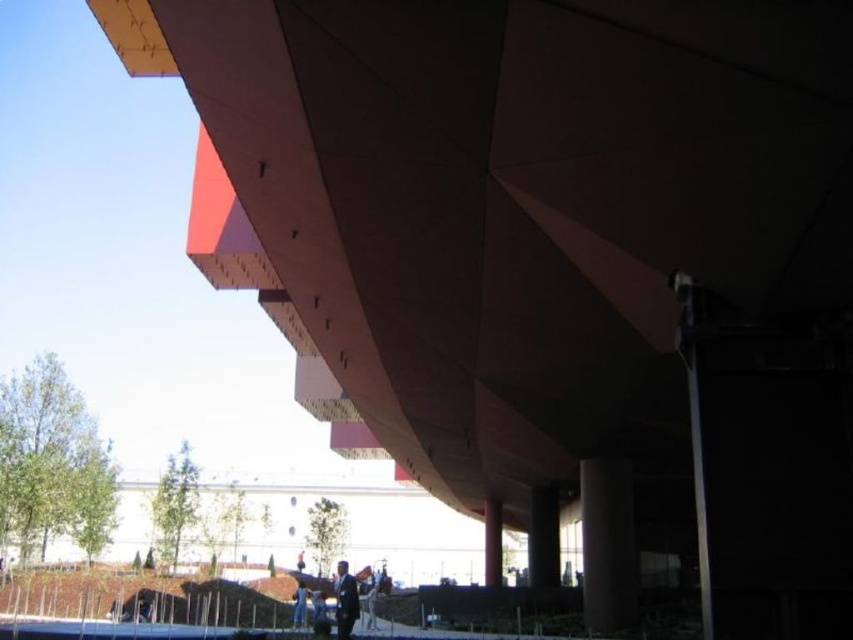
From the picture: Is dark suit at lower center further to the viewer compared to dark blue suit at lower center?

No, dark suit at lower center is in front of dark blue suit at lower center.

From the picture: Does dark suit at lower center appear on the right side of dark blue suit at lower center?

Correct, you'll find dark suit at lower center to the right of dark blue suit at lower center.

Looking at this image, who is more forward, (354,588) or (149,612)?

Point (354,588) is in front.

Find the location of a particular element. The width and height of the screenshot is (853, 640). dark suit at lower center is located at coordinates (345, 600).

Who is taller, dark suit at lower center or dark gray suit at center?

With more height is dark suit at lower center.

Is dark suit at lower center to the left of dark gray suit at center from the viewer's perspective?

Indeed, dark suit at lower center is positioned on the left side of dark gray suit at center.

Where is `dark suit at lower center`? dark suit at lower center is located at coordinates (345, 600).

Which is above, dark suit at lower center or dark blue suit at center?

dark blue suit at center

Which of these two, dark suit at lower center or dark blue suit at center, stands shorter?

With less height is dark blue suit at center.

Where is `dark suit at lower center`? The image size is (853, 640). dark suit at lower center is located at coordinates (345, 600).

Where is `dark suit at lower center`? This screenshot has width=853, height=640. dark suit at lower center is located at coordinates (345, 600).